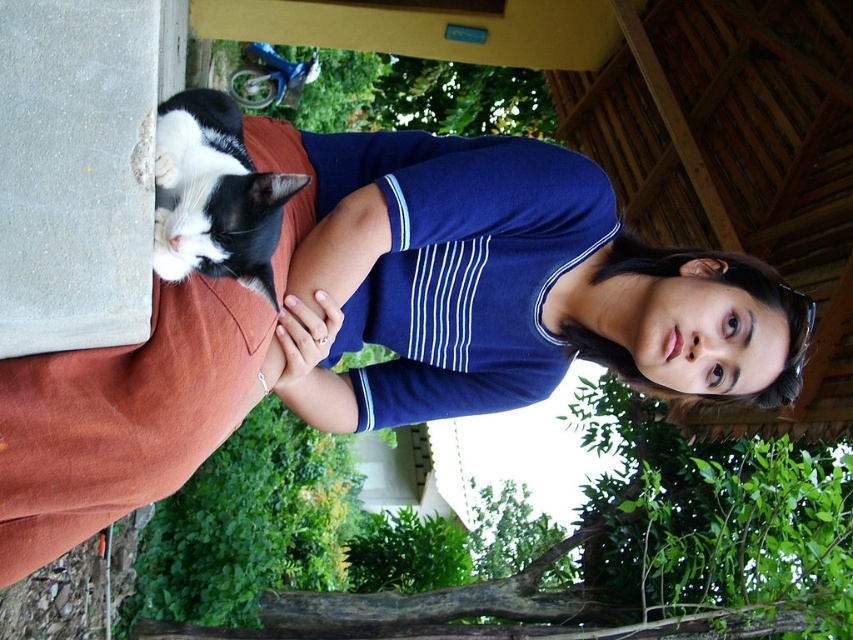
Between matte blue shirt at center and black and white fur cat at upper left, which one is positioned lower?

Positioned lower is matte blue shirt at center.

In the scene shown: Is matte blue shirt at center thinner than black and white fur cat at upper left?

Incorrect, matte blue shirt at center's width is not less than black and white fur cat at upper left's.

Between point (233, 330) and point (248, 196), which one is positioned in front?

Positioned in front is point (248, 196).

I want to click on matte blue shirt at center, so click(387, 324).